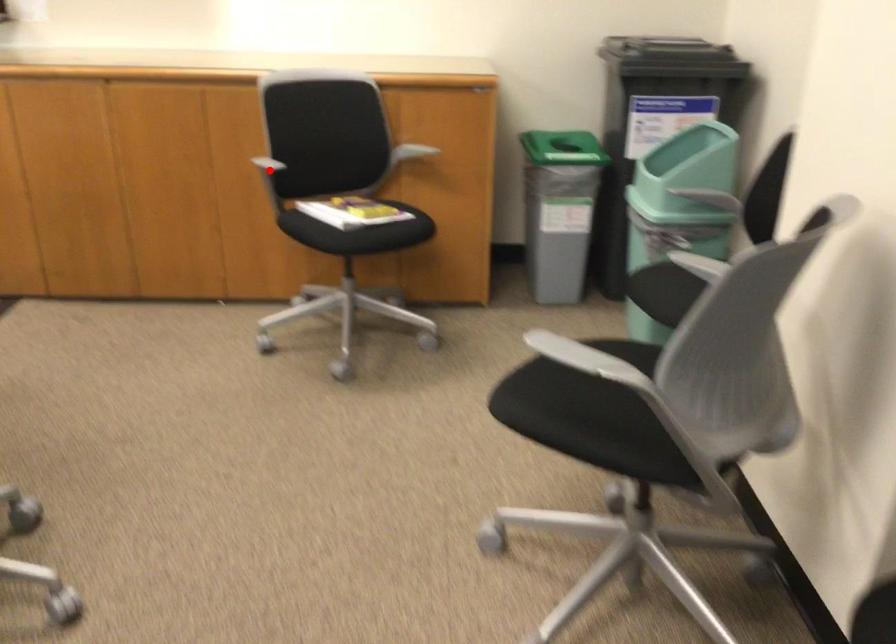
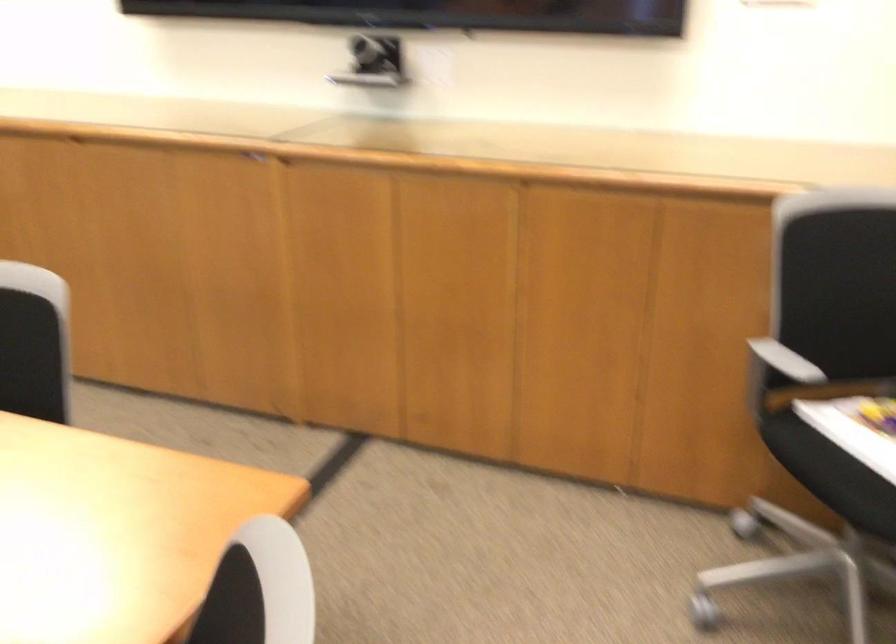
Question: I am providing you with two images of the same scene from different viewpoints. A red point is marked on the first image. Can you still see the location of the red point in image 2?

Choices:
 (A) Yes
 (B) No

Answer: (A)